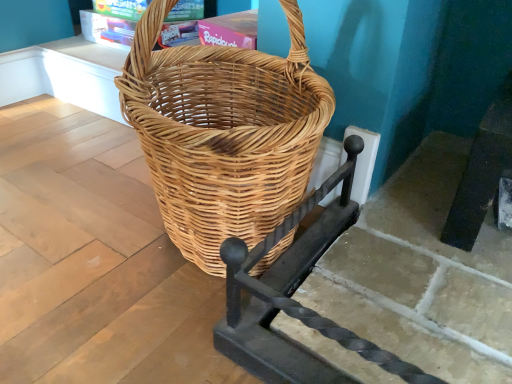
This screenshot has width=512, height=384. Describe the element at coordinates (223, 133) in the screenshot. I see `woven natural wood picnic basket at center` at that location.

I want to click on woven natural wood picnic basket at center, so pos(223,133).

This screenshot has width=512, height=384. Identify the location of woven natural wood picnic basket at center. (223, 133).